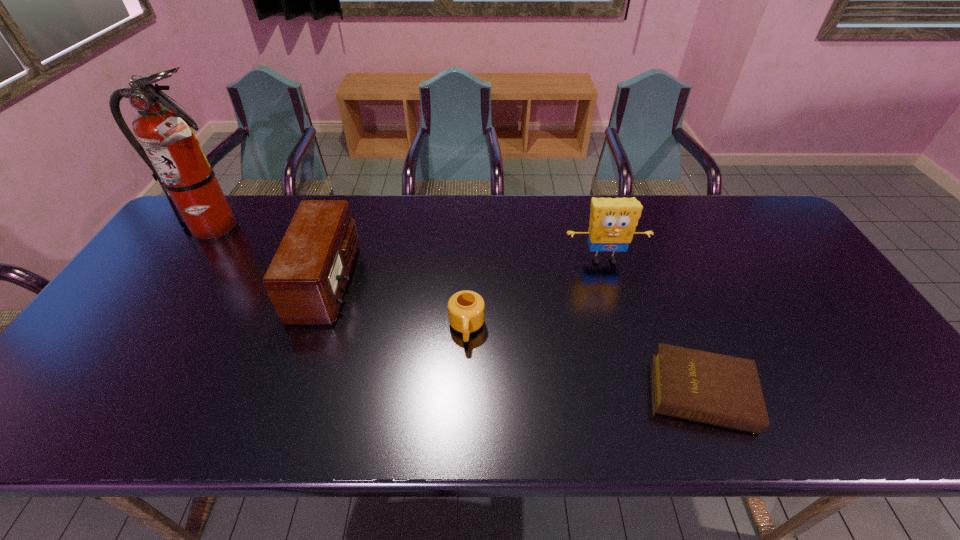
At what (x,y) coordinates should I click in order to perform the action: click on vacant space at the right edge of the desktop. Please return your answer as a coordinate pair (x, y). Looking at the image, I should click on (815, 313).

In order to click on vacant space at the far left corner of the desktop in this screenshot , I will do `click(237, 204)`.

Find the location of a particular element. blank space at the far right corner of the desktop is located at coordinates (735, 197).

The width and height of the screenshot is (960, 540). I want to click on vacant area that lies between the sponge and the second shortest object, so click(535, 294).

You are a GUI agent. You are given a task and a screenshot of the screen. Output one action in this format:
    pyautogui.click(x=<x>, y=<y>)
    Task: Click on the free space that is in between the second tallest object and the tallest object
    The width and height of the screenshot is (960, 540).
    Given the screenshot: What is the action you would take?
    pyautogui.click(x=407, y=245)

Image resolution: width=960 pixels, height=540 pixels. I want to click on vacant area that lies between the leftmost object and the radio receiver, so click(x=270, y=256).

Locate an element on the screen. The image size is (960, 540). vacant area that lies between the nearest object and the fourth tallest object is located at coordinates (585, 360).

Locate an element on the screen. The width and height of the screenshot is (960, 540). blank region between the radio receiver and the Bible is located at coordinates (515, 337).

I want to click on vacant point located between the nearest object and the third tallest object, so click(515, 337).

Image resolution: width=960 pixels, height=540 pixels. What are the coordinates of `vacant point located between the second tallest object and the fire extinguisher` in the screenshot? It's located at (407, 245).